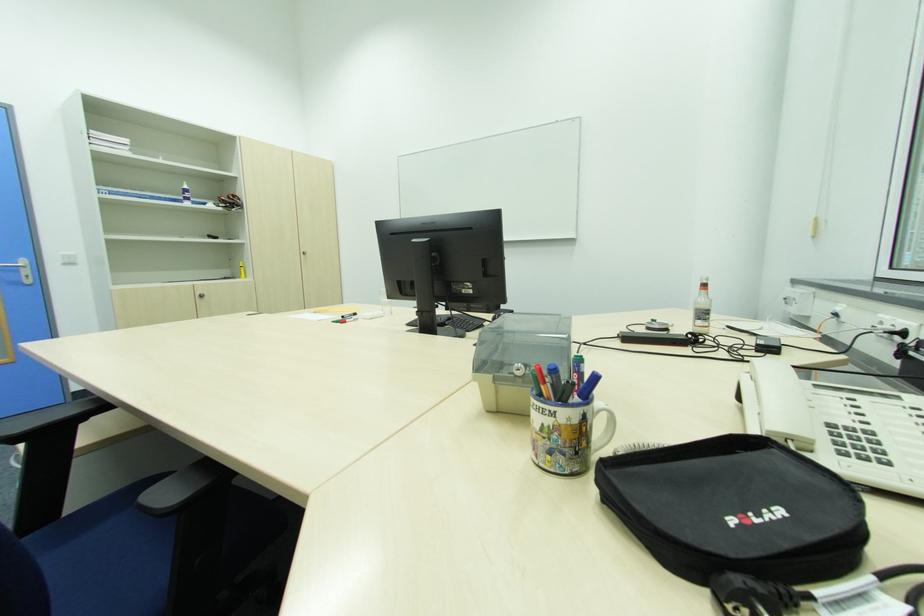
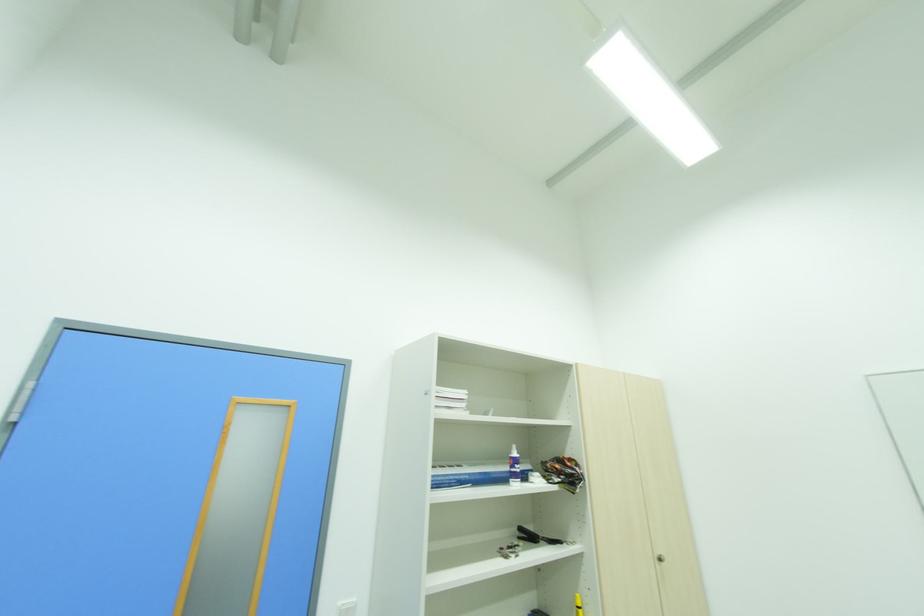
In the second image, find the point that corresponds to (64,254) in the first image.

(344, 604)